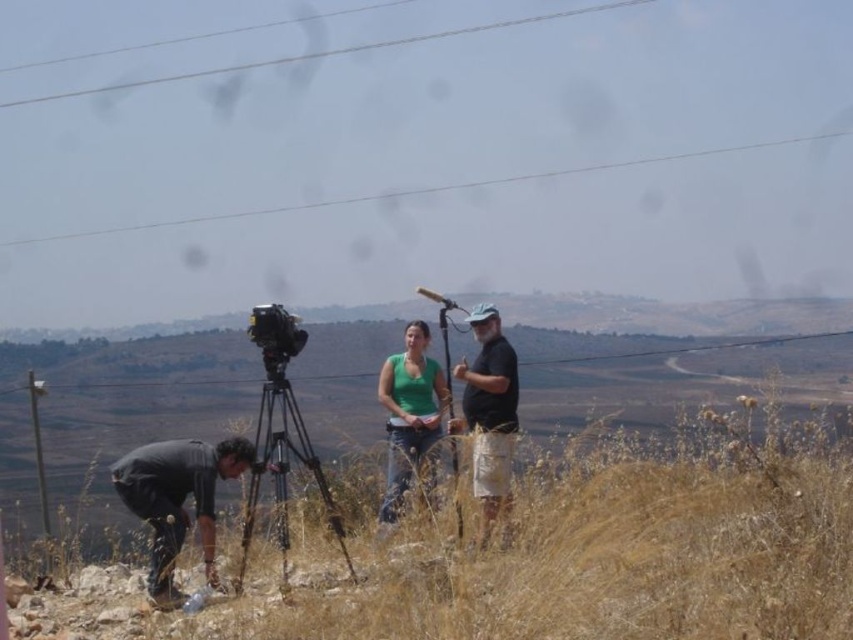
Question: Is dry grass at lower center thinner than clear wire at upper center?

Choices:
 (A) no
 (B) yes

Answer: (B)

Question: Which point is closer to the camera?

Choices:
 (A) green matte tank top at center
 (B) dark gray fabric pants at lower left

Answer: (B)

Question: Does white wire at upper center come behind metallic silver video camera at center?

Choices:
 (A) no
 (B) yes

Answer: (B)

Question: Can you confirm if dry grass at lower center is bigger than clear wire at upper center?

Choices:
 (A) yes
 (B) no

Answer: (B)

Question: Which of the following is the closest to the observer?

Choices:
 (A) (x=282, y=356)
 (B) (x=469, y=504)

Answer: (A)

Question: Which object is farther from the camera taking this photo?

Choices:
 (A) dry grass at lower center
 (B) clear wire at upper center

Answer: (B)